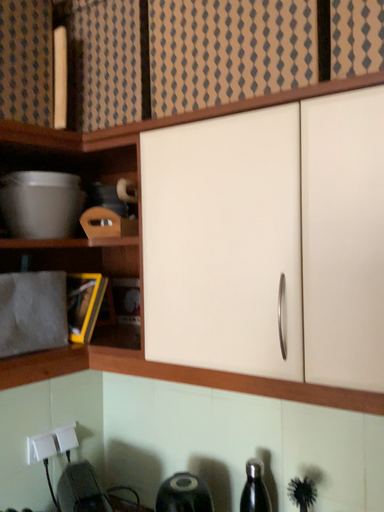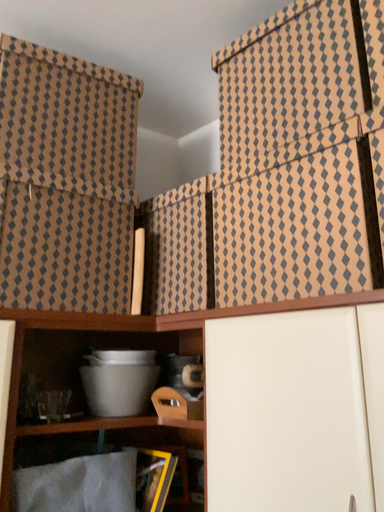
Question: How did the camera likely rotate when shooting the video?

Choices:
 (A) rotated right
 (B) rotated left

Answer: (B)